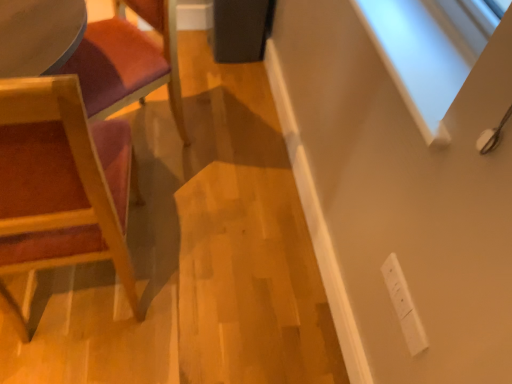
Question: Considering the relative sizes of wooden chair at left, the 2th chair ordered from the bottom, and white plastic electric outlet at lower right in the image provided, is wooden chair at left, the 2th chair ordered from the bottom, thinner than white plastic electric outlet at lower right?

Choices:
 (A) yes
 (B) no

Answer: (B)

Question: Is wooden chair at left, the 2th chair ordered from the bottom, taller than white plastic electric outlet at lower right?

Choices:
 (A) no
 (B) yes

Answer: (B)

Question: Is wooden chair at left, marked as the 1th chair in a top-to-bottom arrangement, next to white plastic electric outlet at lower right and touching it?

Choices:
 (A) no
 (B) yes

Answer: (A)

Question: Is wooden chair at left, marked as the 1th chair in a top-to-bottom arrangement, aimed at white plastic electric outlet at lower right?

Choices:
 (A) no
 (B) yes

Answer: (A)

Question: Is wooden chair at left, the 2th chair ordered from the bottom, far away from white plastic electric outlet at lower right?

Choices:
 (A) yes
 (B) no

Answer: (A)

Question: Is wooden chair at left, marked as the 1th chair in a top-to-bottom arrangement, positioned with its back to white plastic electric outlet at lower right?

Choices:
 (A) no
 (B) yes

Answer: (A)

Question: Is wooden chair at left, arranged as the 1th chair when ordered from the bottom, not close to wooden chair at left, the 2th chair ordered from the bottom?

Choices:
 (A) no
 (B) yes

Answer: (A)

Question: Considering the relative sizes of wooden chair at left, which is counted as the second chair, starting from the top, and wooden chair at left, the 2th chair ordered from the bottom, in the image provided, is wooden chair at left, which is counted as the second chair, starting from the top, taller than wooden chair at left, the 2th chair ordered from the bottom,?

Choices:
 (A) yes
 (B) no

Answer: (A)

Question: From a real-world perspective, is wooden chair at left, arranged as the 1th chair when ordered from the bottom, below wooden chair at left, marked as the 1th chair in a top-to-bottom arrangement?

Choices:
 (A) yes
 (B) no

Answer: (B)

Question: Is the position of wooden chair at left, arranged as the 1th chair when ordered from the bottom, less distant than that of wooden chair at left, marked as the 1th chair in a top-to-bottom arrangement?

Choices:
 (A) yes
 (B) no

Answer: (A)

Question: Is wooden chair at left, arranged as the 1th chair when ordered from the bottom, looking in the opposite direction of wooden chair at left, marked as the 1th chair in a top-to-bottom arrangement?

Choices:
 (A) no
 (B) yes

Answer: (A)

Question: From the image's perspective, does wooden chair at left, arranged as the 1th chair when ordered from the bottom, appear higher than wooden chair at left, the 2th chair ordered from the bottom?

Choices:
 (A) yes
 (B) no

Answer: (B)

Question: Does white plastic electric outlet at lower right appear on the left side of wooden chair at left, the 2th chair ordered from the bottom?

Choices:
 (A) yes
 (B) no

Answer: (B)